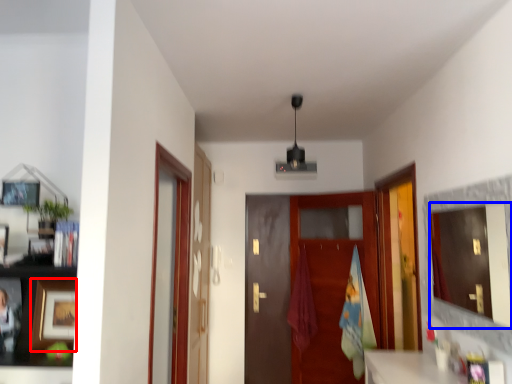
Question: Which point is closer to the camera, picture frame (highlighted by a red box) or mirror (highlighted by a blue box)?

Choices:
 (A) picture frame
 (B) mirror

Answer: (B)